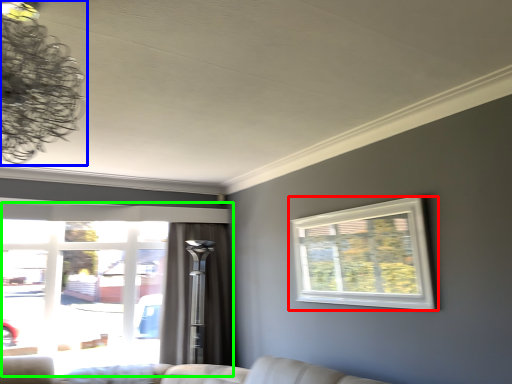
Question: Considering the real-world distances, which object is farthest from window (highlighted by a red box)? lamp (highlighted by a blue box) or window (highlighted by a green box)?

Choices:
 (A) lamp
 (B) window

Answer: (B)